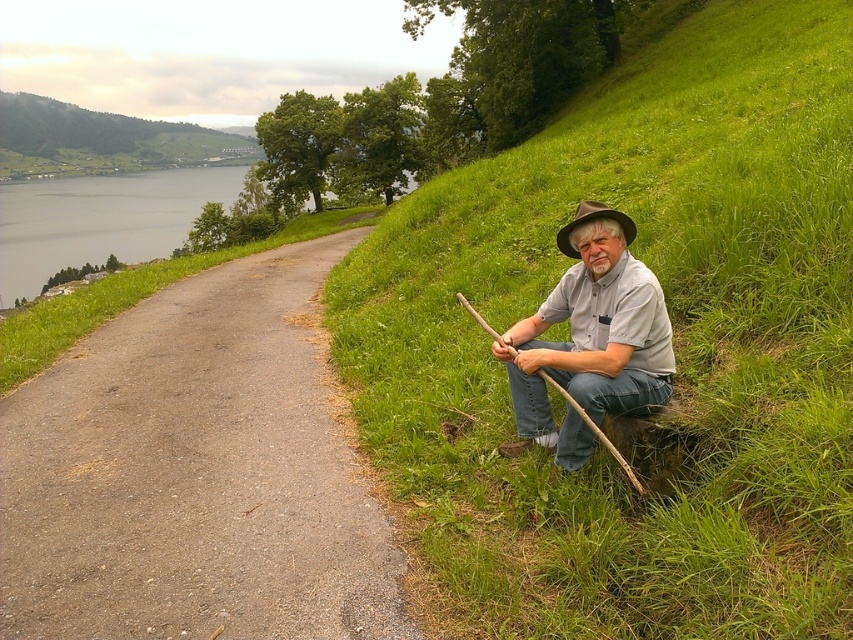
Question: Does green grassy hillside at upper left have a lesser width compared to brown felt hat at right?

Choices:
 (A) yes
 (B) no

Answer: (B)

Question: Does gray asphalt road at center have a greater width compared to green grassy hillside at upper left?

Choices:
 (A) no
 (B) yes

Answer: (A)

Question: Which object appears farthest from the camera in this image?

Choices:
 (A) brown felt hat at right
 (B) green grassy hillside at right

Answer: (A)

Question: Estimate the real-world distances between objects in this image. Which object is closer to the brown felt hat at right?

Choices:
 (A) gray asphalt road at center
 (B) green grassy hillside at upper left

Answer: (A)

Question: Which object appears farthest from the camera in this image?

Choices:
 (A) gray cotton shirt at lower right
 (B) green grassy hillside at right
 (C) brown felt hat at right
 (D) gray asphalt road at center

Answer: (C)

Question: Can you confirm if green grassy hillside at right is smaller than gray asphalt road at center?

Choices:
 (A) yes
 (B) no

Answer: (B)